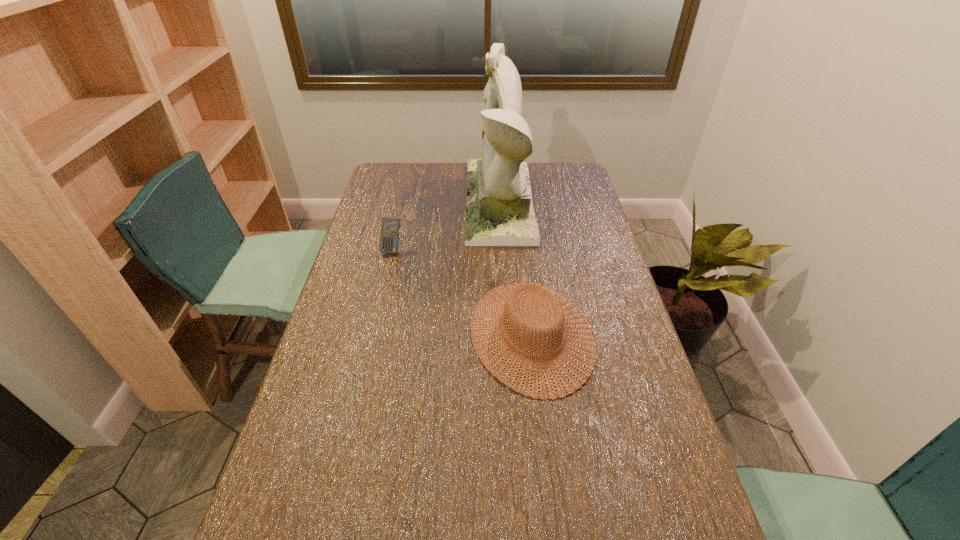
Point out which object is positioned as the second nearest to the sunhat. Please provide its 2D coordinates. Your answer should be formatted as a tuple, i.e. [(x, y)], where the tuple contains the x and y coordinates of a point satisfying the conditions above.

[(389, 237)]

Locate which object is the closest to the sculpture. Please provide its 2D coordinates. Your answer should be formatted as a tuple, i.e. [(x, y)], where the tuple contains the x and y coordinates of a point satisfying the conditions above.

[(549, 304)]

Locate an element on the screen. The height and width of the screenshot is (540, 960). vacant point that satisfies the following two spatial constraints: 1. on the base of the tallest object; 2. on the front-facing side of the leftmost object is located at coordinates (502, 249).

You are a GUI agent. You are given a task and a screenshot of the screen. Output one action in this format:
    pyautogui.click(x=<x>, y=<y>)
    Task: Click on the vacant region that satisfies the following two spatial constraints: 1. on the base of the sculpture; 2. on the right side of the nearest object
    This screenshot has width=960, height=540.
    Given the screenshot: What is the action you would take?
    pyautogui.click(x=508, y=334)

Find the location of a particular element. free space that satisfies the following two spatial constraints: 1. on the base of the sculpture; 2. on the left side of the sunhat is located at coordinates (508, 334).

Identify the location of vacant space that satisfies the following two spatial constraints: 1. on the base of the nearest object; 2. on the left side of the sculpture. (508, 334).